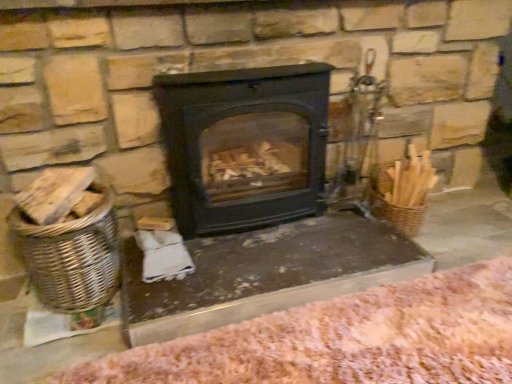
Question: From a real-world perspective, is pink woolen blanket at lower right positioned under black matte wood burning stove at center based on gravity?

Choices:
 (A) no
 (B) yes

Answer: (B)

Question: Considering the relative sizes of pink woolen blanket at lower right and black matte wood burning stove at center in the image provided, is pink woolen blanket at lower right taller than black matte wood burning stove at center?

Choices:
 (A) yes
 (B) no

Answer: (B)

Question: Is pink woolen blanket at lower right to the left of black matte wood burning stove at center from the viewer's perspective?

Choices:
 (A) yes
 (B) no

Answer: (B)

Question: Is pink woolen blanket at lower right smaller than black matte wood burning stove at center?

Choices:
 (A) no
 (B) yes

Answer: (B)

Question: Can you confirm if pink woolen blanket at lower right is wider than black matte wood burning stove at center?

Choices:
 (A) yes
 (B) no

Answer: (A)

Question: From the image's perspective, is pink woolen blanket at lower right under black matte wood burning stove at center?

Choices:
 (A) yes
 (B) no

Answer: (A)

Question: Considering the relative sizes of black matte wood burning stove at center and smooth stone table at center in the image provided, is black matte wood burning stove at center wider than smooth stone table at center?

Choices:
 (A) yes
 (B) no

Answer: (B)

Question: Considering the relative positions of black matte wood burning stove at center and smooth stone table at center in the image provided, is black matte wood burning stove at center to the left of smooth stone table at center from the viewer's perspective?

Choices:
 (A) yes
 (B) no

Answer: (A)

Question: Does black matte wood burning stove at center have a lesser width compared to smooth stone table at center?

Choices:
 (A) no
 (B) yes

Answer: (B)

Question: Is black matte wood burning stove at center smaller than smooth stone table at center?

Choices:
 (A) yes
 (B) no

Answer: (B)

Question: Is black matte wood burning stove at center in front of smooth stone table at center?

Choices:
 (A) yes
 (B) no

Answer: (B)

Question: Could you tell me if black matte wood burning stove at center is turned towards smooth stone table at center?

Choices:
 (A) no
 (B) yes

Answer: (A)

Question: Is pink woolen blanket at lower right outside woven brown basket at left?

Choices:
 (A) no
 (B) yes

Answer: (B)